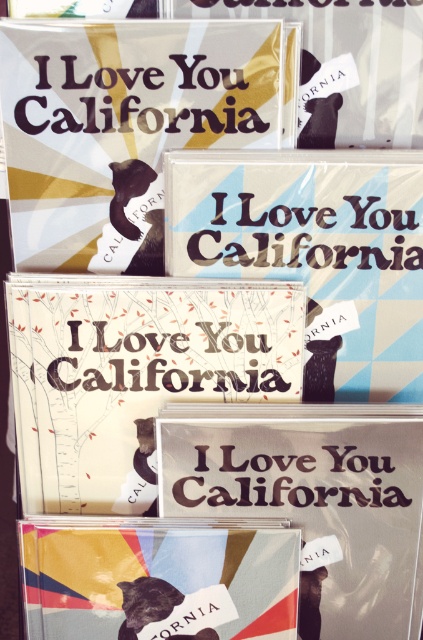
Question: Which object is the farthest from the matte paper poster at upper center?

Choices:
 (A) matte paper poster at center
 (B) matte gold poster at upper center
 (C) matte paper card at center
 (D) matte paper cd at center

Answer: (D)

Question: Observing the image, what is the correct spatial positioning of matte paper card at center in reference to blue paper poster at center?

Choices:
 (A) above
 (B) below

Answer: (B)

Question: Which point is farther to the camera?

Choices:
 (A) (187, 561)
 (B) (52, 38)

Answer: (A)

Question: Can you confirm if matte paper poster at center is positioned below matte paper cd at center?

Choices:
 (A) no
 (B) yes

Answer: (A)

Question: Can you confirm if matte paper card at center is thinner than matte paper cd at center?

Choices:
 (A) yes
 (B) no

Answer: (B)

Question: Which is farther from the matte paper cd at center?

Choices:
 (A) matte gold poster at upper center
 (B) blue paper poster at center

Answer: (A)